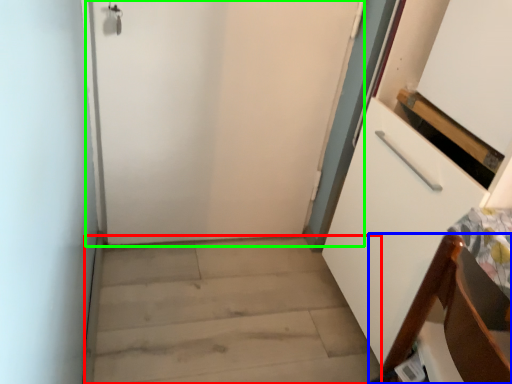
Question: Which object is positioned closest to stairwell (highlighted by a red box)? Select from furniture (highlighted by a blue box) and door (highlighted by a green box).

Choices:
 (A) furniture
 (B) door

Answer: (B)